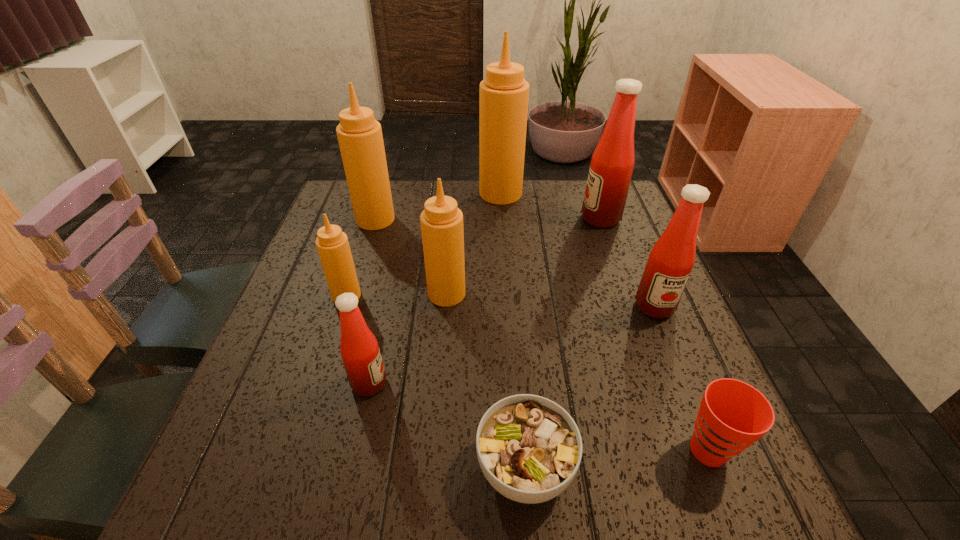
Where is `the eighth tallest object`? the eighth tallest object is located at coordinates (733, 415).

You are a GUI agent. You are given a task and a screenshot of the screen. Output one action in this format:
    pyautogui.click(x=<x>, y=<y>)
    Task: Click on the soup bowl
    Image resolution: width=960 pixels, height=540 pixels.
    Given the screenshot: What is the action you would take?
    pyautogui.click(x=529, y=448)

This screenshot has height=540, width=960. In order to click on white soup bowl in this screenshot , I will do `click(529, 448)`.

This screenshot has height=540, width=960. Find the location of `vacant space situated on the front of the tallest condiment`. vacant space situated on the front of the tallest condiment is located at coordinates (507, 286).

The height and width of the screenshot is (540, 960). Find the location of `blank area located 0.050m on the front-facing side of the biggest red condiment`. blank area located 0.050m on the front-facing side of the biggest red condiment is located at coordinates (564, 218).

Locate an element on the screen. free location located on the front-facing side of the biggest red condiment is located at coordinates (497, 218).

You are a GUI agent. You are given a task and a screenshot of the screen. Output one action in this format:
    pyautogui.click(x=<x>, y=<y>)
    Task: Click on the vacant space located on the front-facing side of the biggest red condiment
    Image resolution: width=960 pixels, height=540 pixels.
    Given the screenshot: What is the action you would take?
    pyautogui.click(x=525, y=218)

This screenshot has width=960, height=540. I want to click on vacant space located 0.100m on the right of the third smallest tan condiment, so click(x=430, y=219).

Locate an element on the screen. vacant space located on the right of the third tan condiment from left to right is located at coordinates (495, 294).

Find the location of a particular element. vacant region located 0.310m on the front-facing side of the second nearest red condiment is located at coordinates (717, 458).